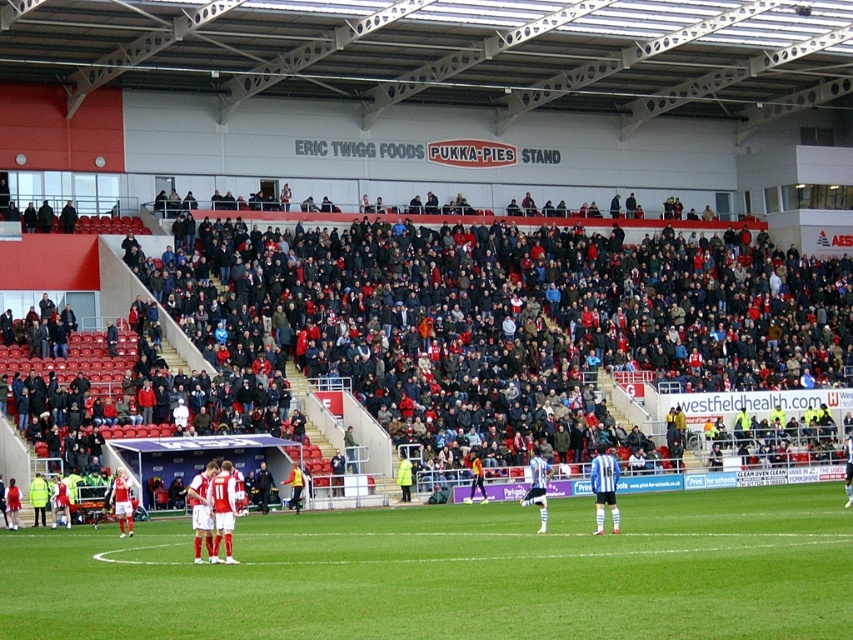
Question: Among these points, which one is nearest to the camera?

Choices:
 (A) (221, 497)
 (B) (473, 456)

Answer: (A)

Question: Among these objects, which one is nearest to the camera?

Choices:
 (A) red fabric jersey at lower left
 (B) yellow jersey at center
 (C) blue striped jersey at center

Answer: (C)

Question: Observing the image, what is the correct spatial positioning of blue jersey at center in reference to yellow reflective jacket at center?

Choices:
 (A) right
 (B) left

Answer: (A)

Question: Which point is closer to the camera?

Choices:
 (A) (299, 474)
 (B) (482, 500)
 (C) (115, 476)
 (D) (230, 472)

Answer: (D)

Question: Where is matte red soccer jersey at center located in relation to yellow jersey at center in the image?

Choices:
 (A) below
 (B) above

Answer: (B)

Question: Can you confirm if white jersey at center is positioned above blue jersey at center?

Choices:
 (A) no
 (B) yes

Answer: (B)